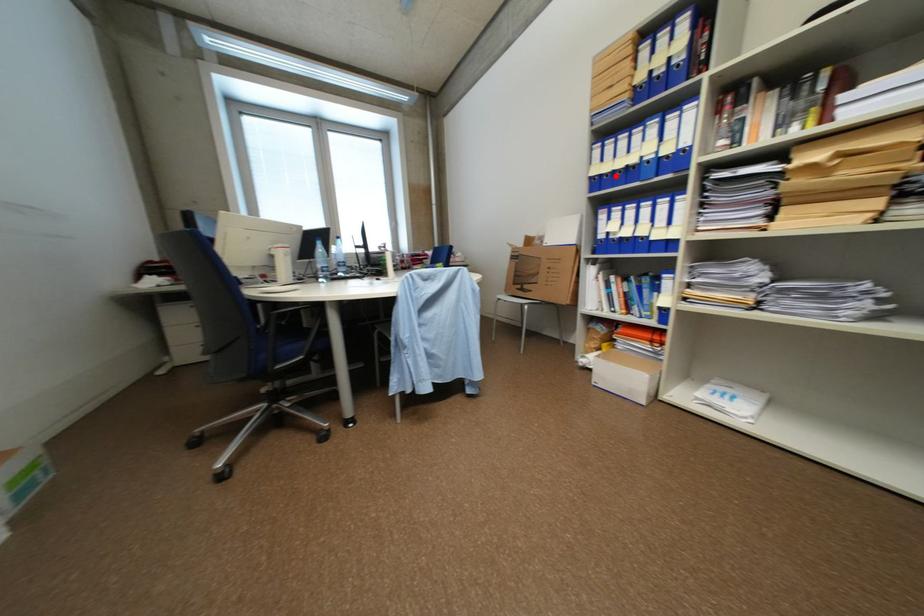
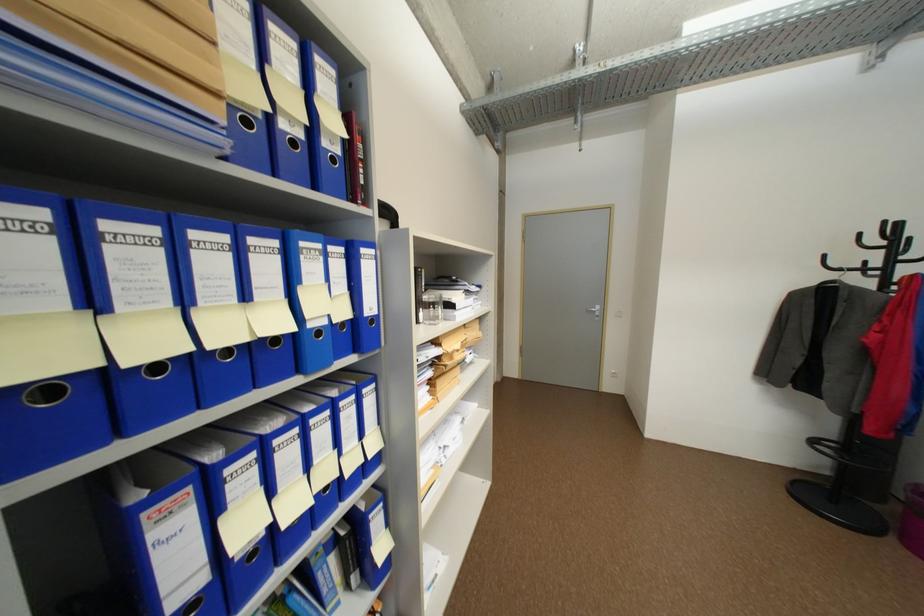
In the second image, find the point that corresponds to the highlighted location in the first image.

(164, 368)